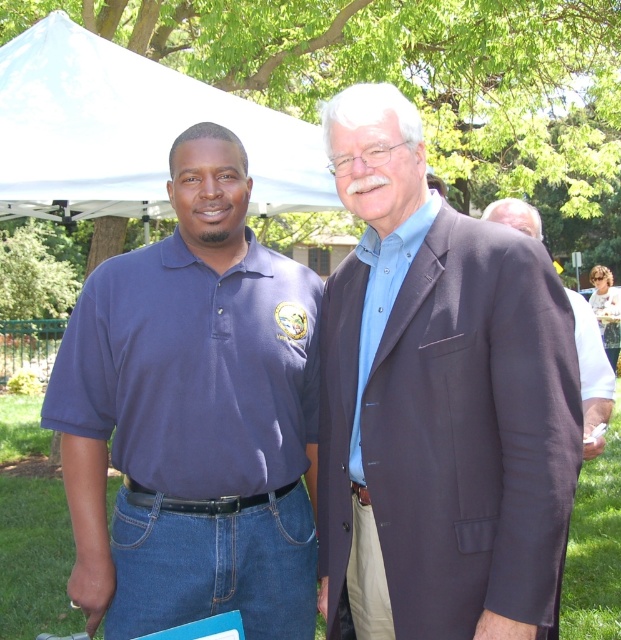
Between blue cotton shirt at center and white fabric canopy at upper center, which one is positioned higher?

white fabric canopy at upper center is higher up.

Where is `blue cotton shirt at center`? Image resolution: width=621 pixels, height=640 pixels. blue cotton shirt at center is located at coordinates (437, 403).

Identify the location of blue cotton shirt at center. This screenshot has width=621, height=640. (437, 403).

Looking at this image, does matte blue polo shirt at left appear over dark blue suit at center?

No.

At what (x,y) coordinates should I click in order to perform the action: click on matte blue polo shirt at left. Please return your answer as a coordinate pair (x, y). The image size is (621, 640). Looking at the image, I should click on (193, 417).

Where is `matte blue polo shirt at left`? Image resolution: width=621 pixels, height=640 pixels. matte blue polo shirt at left is located at coordinates (193, 417).

Between point (175, 372) and point (176, 90), which one is positioned in front?

Positioned in front is point (175, 372).

Between matte blue polo shirt at left and white fabric canopy at upper center, which one has more height?

white fabric canopy at upper center

Is point (91, 429) closer to viewer compared to point (165, 163)?

Yes.

This screenshot has width=621, height=640. Find the location of `matte blue polo shirt at left`. matte blue polo shirt at left is located at coordinates click(193, 417).